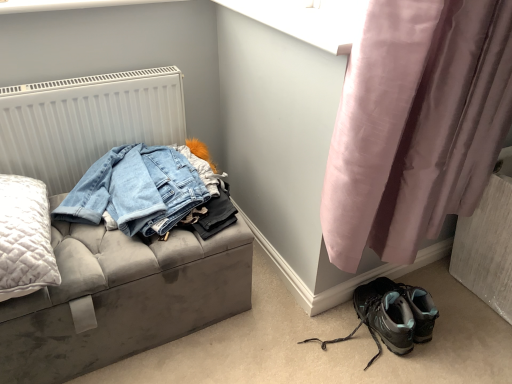
Image resolution: width=512 pixels, height=384 pixels. In order to click on matte black hiking boots at lower right in this screenshot , I will do `click(392, 315)`.

This screenshot has width=512, height=384. In order to click on pink satin curtain at lower right in this screenshot , I will do `click(416, 124)`.

Considering the relative sizes of matte black hiking boots at lower right and pink satin curtain at lower right in the image provided, is matte black hiking boots at lower right taller than pink satin curtain at lower right?

No, matte black hiking boots at lower right is not taller than pink satin curtain at lower right.

Considering the positions of objects matte black hiking boots at lower right and pink satin curtain at lower right in the image provided, who is more to the left, matte black hiking boots at lower right or pink satin curtain at lower right?

Positioned to the left is matte black hiking boots at lower right.

Which object is further away from the camera taking this photo, matte black hiking boots at lower right or pink satin curtain at lower right?

matte black hiking boots at lower right.

Considering their positions, is velvet grey storage bench at left located in front of or behind white textured radiator at upper left?

velvet grey storage bench at left is in front of white textured radiator at upper left.

From the image's perspective, between velvet grey storage bench at left and white textured radiator at upper left, who is located below?

velvet grey storage bench at left appears lower in the image.

In the scene shown: Considering the positions of objects velvet grey storage bench at left and white textured radiator at upper left in the image provided, who is more to the left, velvet grey storage bench at left or white textured radiator at upper left?

white textured radiator at upper left.

Is the surface of white textured radiator at upper left in direct contact with matte black hiking boots at lower right?

No, white textured radiator at upper left is not with matte black hiking boots at lower right.

Which is correct: white textured radiator at upper left is inside matte black hiking boots at lower right, or outside of it?

white textured radiator at upper left is spatially situated outside matte black hiking boots at lower right.

From a real-world perspective, is white textured radiator at upper left positioned above or below matte black hiking boots at lower right?

Clearly, from a real-world perspective, white textured radiator at upper left is above matte black hiking boots at lower right.

What are the coordinates of `radiator on the left of matte black hiking boots at lower right` in the screenshot? It's located at (86, 121).

Which is closer, (443, 118) or (371, 296)?

Point (443, 118)

Does pink satin curtain at lower right have a smaller size compared to matte black hiking boots at lower right?

Actually, pink satin curtain at lower right might be larger than matte black hiking boots at lower right.

From the image's perspective, is pink satin curtain at lower right over matte black hiking boots at lower right?

Yes, from the image's perspective, pink satin curtain at lower right is above matte black hiking boots at lower right.

Can you confirm if pink satin curtain at lower right is taller than matte black hiking boots at lower right?

Indeed, pink satin curtain at lower right has a greater height compared to matte black hiking boots at lower right.

Is velvet grey storage bench at left positioned with its back to pink satin curtain at lower right?

No.

Considering their positions, is velvet grey storage bench at left located in front of or behind pink satin curtain at lower right?

velvet grey storage bench at left is behind pink satin curtain at lower right.

Considering the relative sizes of velvet grey storage bench at left and pink satin curtain at lower right in the image provided, is velvet grey storage bench at left taller than pink satin curtain at lower right?

Incorrect, the height of velvet grey storage bench at left is not larger of that of pink satin curtain at lower right.

Between matte black hiking boots at lower right and velvet grey storage bench at left, which one has larger width?

Wider between the two is velvet grey storage bench at left.

From a real-world perspective, does matte black hiking boots at lower right sit lower than velvet grey storage bench at left?

Yes, from a real-world perspective, matte black hiking boots at lower right is below velvet grey storage bench at left.

From the image's perspective, which is below, matte black hiking boots at lower right or velvet grey storage bench at left?

matte black hiking boots at lower right, from the image's perspective.

Considering the sizes of objects matte black hiking boots at lower right and velvet grey storage bench at left in the image provided, who is smaller, matte black hiking boots at lower right or velvet grey storage bench at left?

Smaller between the two is matte black hiking boots at lower right.

From the image's perspective, is velvet grey storage bench at left above or below matte black hiking boots at lower right?

velvet grey storage bench at left is situated higher than matte black hiking boots at lower right in the image.

Considering the sizes of objects velvet grey storage bench at left and matte black hiking boots at lower right in the image provided, who is smaller, velvet grey storage bench at left or matte black hiking boots at lower right?

With smaller size is matte black hiking boots at lower right.

In the scene shown: Is velvet grey storage bench at left placed right next to matte black hiking boots at lower right?

They are not placed beside each other.

From a real-world perspective, between velvet grey storage bench at left and matte black hiking boots at lower right, who is vertically higher?

In real-world perspective, velvet grey storage bench at left is above.

Identify the location of footwear located on the left of pink satin curtain at lower right. (392, 315).

The width and height of the screenshot is (512, 384). Identify the location of furniture in front of the white textured radiator at upper left. (122, 298).

From the picture: Which object lies nearer to the anchor point white textured radiator at upper left, pink satin curtain at lower right or velvet grey storage bench at left?

Among the two, velvet grey storage bench at left is located nearer to white textured radiator at upper left.

When comparing their distances from velvet grey storage bench at left, does matte black hiking boots at lower right or white textured radiator at upper left seem further?

The object further to velvet grey storage bench at left is matte black hiking boots at lower right.

Based on their spatial positions, is matte black hiking boots at lower right or velvet grey storage bench at left further from pink satin curtain at lower right?

Based on the image, velvet grey storage bench at left appears to be further to pink satin curtain at lower right.

Estimate the real-world distances between objects in this image. Which object is further from pink satin curtain at lower right, velvet grey storage bench at left or white textured radiator at upper left?

white textured radiator at upper left is positioned further to the anchor pink satin curtain at lower right.

Estimate the real-world distances between objects in this image. Which object is further from velvet grey storage bench at left, white textured radiator at upper left or matte black hiking boots at lower right?

matte black hiking boots at lower right lies further to velvet grey storage bench at left than the other object.

Looking at this image, estimate the real-world distances between objects in this image. Which object is further from white textured radiator at upper left, velvet grey storage bench at left or matte black hiking boots at lower right?

matte black hiking boots at lower right lies further to white textured radiator at upper left than the other object.

Estimate the real-world distances between objects in this image. Which object is further from white textured radiator at upper left, velvet grey storage bench at left or pink satin curtain at lower right?

The object further to white textured radiator at upper left is pink satin curtain at lower right.

Which object lies further to the anchor point pink satin curtain at lower right, white textured radiator at upper left or velvet grey storage bench at left?

white textured radiator at upper left lies further to pink satin curtain at lower right than the other object.

You are a GUI agent. You are given a task and a screenshot of the screen. Output one action in this format:
    pyautogui.click(x=<x>, y=<y>)
    Task: Click on the furniture between white textured radiator at upper left and matte black hiking boots at lower right from left to right
    This screenshot has height=384, width=512.
    Given the screenshot: What is the action you would take?
    pyautogui.click(x=122, y=298)

This screenshot has width=512, height=384. Identify the location of footwear between white textured radiator at upper left and pink satin curtain at lower right in the horizontal direction. (392, 315).

Identify the location of footwear between velvet grey storage bench at left and pink satin curtain at lower right from left to right. (392, 315).

Find the location of `furniture situated between white textured radiator at upper left and pink satin curtain at lower right from left to right`. furniture situated between white textured radiator at upper left and pink satin curtain at lower right from left to right is located at coordinates (122, 298).